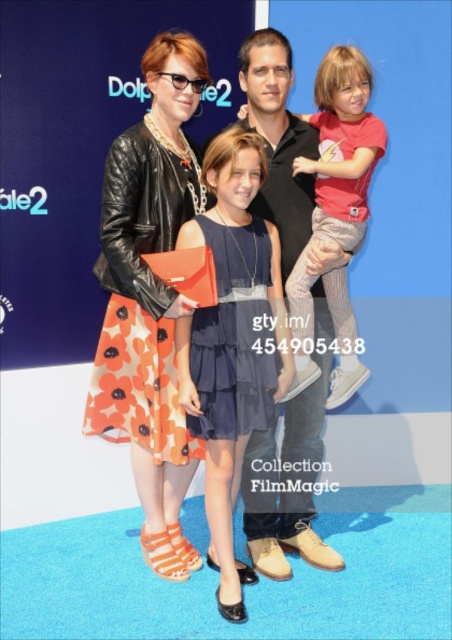
Is leather jacket at center positioned behind red cotton shirt at upper right?

Yes, it is behind red cotton shirt at upper right.

This screenshot has width=452, height=640. What do you see at coordinates (150, 298) in the screenshot?
I see `leather jacket at center` at bounding box center [150, 298].

Locate an element on the screen. The height and width of the screenshot is (640, 452). leather jacket at center is located at coordinates pyautogui.click(x=150, y=298).

Is the position of matte black jacket at center less distant than that of orange floral dress at center?

No, matte black jacket at center is behind orange floral dress at center.

Is matte black jacket at center to the left of orange floral dress at center from the viewer's perspective?

Incorrect, matte black jacket at center is not on the left side of orange floral dress at center.

Who is more forward, [170,166] or [232,196]?

Point [232,196] is in front.

Image resolution: width=452 pixels, height=640 pixels. What are the coordinates of `matte black jacket at center` in the screenshot? It's located at (278, 141).

Which is below, orange floral dress at center or red cotton shirt at upper right?

orange floral dress at center is lower down.

Who is more forward, (x=258, y=380) or (x=333, y=298)?

Point (x=258, y=380) is more forward.

Where is `orange floral dress at center`? The image size is (452, 640). orange floral dress at center is located at coordinates (232, 340).